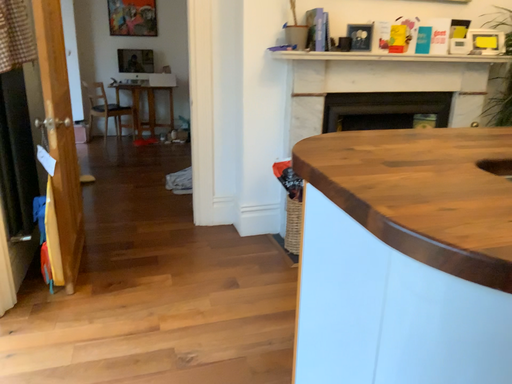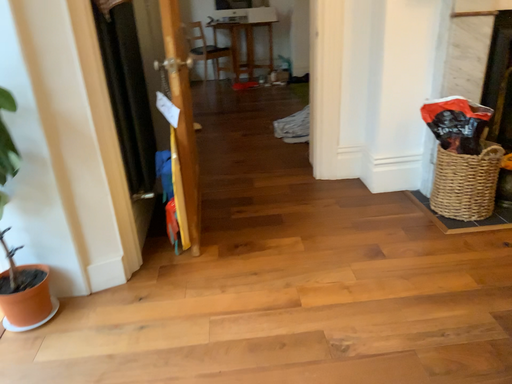
Question: Which way did the camera rotate in the video?

Choices:
 (A) rotated left
 (B) rotated right

Answer: (A)